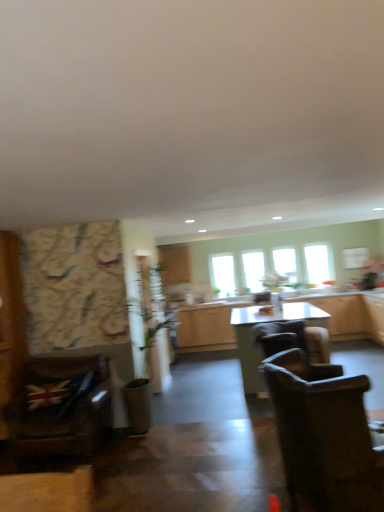
Question: Considering the relative sizes of green leafy plant at center and transparent glass window at upper right, arranged as the fourth window when viewed from the left, in the image provided, is green leafy plant at center shorter than transparent glass window at upper right, arranged as the fourth window when viewed from the left,?

Choices:
 (A) yes
 (B) no

Answer: (B)

Question: Can you confirm if green leafy plant at center is smaller than transparent glass window at upper right, arranged as the fourth window when viewed from the left?

Choices:
 (A) no
 (B) yes

Answer: (A)

Question: Is green leafy plant at center touching transparent glass window at upper right, arranged as the fourth window when viewed from the left?

Choices:
 (A) no
 (B) yes

Answer: (A)

Question: Is green leafy plant at center not close to transparent glass window at upper right, the 1th window in the right-to-left sequence?

Choices:
 (A) yes
 (B) no

Answer: (A)

Question: From the image's perspective, would you say green leafy plant at center is shown under transparent glass window at upper right, the 1th window in the right-to-left sequence?

Choices:
 (A) no
 (B) yes

Answer: (B)

Question: From the image's perspective, is transparent glass window at center, which is the 4th window in right-to-left order, located above or below dark brown fabric chair at lower right, acting as the third chair starting from the back?

Choices:
 (A) below
 (B) above

Answer: (B)

Question: Is transparent glass window at center, arranged as the first window when viewed from the left, in front of or behind dark brown fabric chair at lower right, acting as the third chair starting from the back, in the image?

Choices:
 (A) front
 (B) behind

Answer: (B)

Question: In the image, is transparent glass window at center, arranged as the first window when viewed from the left, on the left side or the right side of dark brown fabric chair at lower right, the second chair from the left?

Choices:
 (A) right
 (B) left

Answer: (B)

Question: Would you say transparent glass window at center, which is the 4th window in right-to-left order, is inside or outside dark brown fabric chair at lower right, which ranks as the first chair in front-to-back order?

Choices:
 (A) inside
 (B) outside

Answer: (B)

Question: Is dark brown fabric chair at lower right, which ranks as the first chair in front-to-back order, to the left or to the right of wooden cabinets at center, the first cabinetry viewed from the right, in the image?

Choices:
 (A) right
 (B) left

Answer: (B)

Question: Looking at their shapes, would you say dark brown fabric chair at lower right, which appears as the second chair when viewed from the right, is wider or thinner than wooden cabinets at center, the first cabinetry viewed from the right?

Choices:
 (A) wide
 (B) thin

Answer: (A)

Question: From the image's perspective, is dark brown fabric chair at lower right, the second chair from the left, above or below wooden cabinets at center, marked as the second cabinetry in a left-to-right arrangement?

Choices:
 (A) above
 (B) below

Answer: (A)

Question: Is point (283, 412) closer or farther from the camera than point (215, 323)?

Choices:
 (A) farther
 (B) closer

Answer: (B)

Question: Which is correct: dark brown fabric chair at lower right, the second chair from the left, is inside transparent glass window at center, which appears as the second window when viewed from the left, or outside of it?

Choices:
 (A) outside
 (B) inside

Answer: (A)

Question: Considering their positions, is dark brown fabric chair at lower right, the second chair from the left, located in front of or behind transparent glass window at center, which appears as the second window when viewed from the left?

Choices:
 (A) front
 (B) behind

Answer: (A)